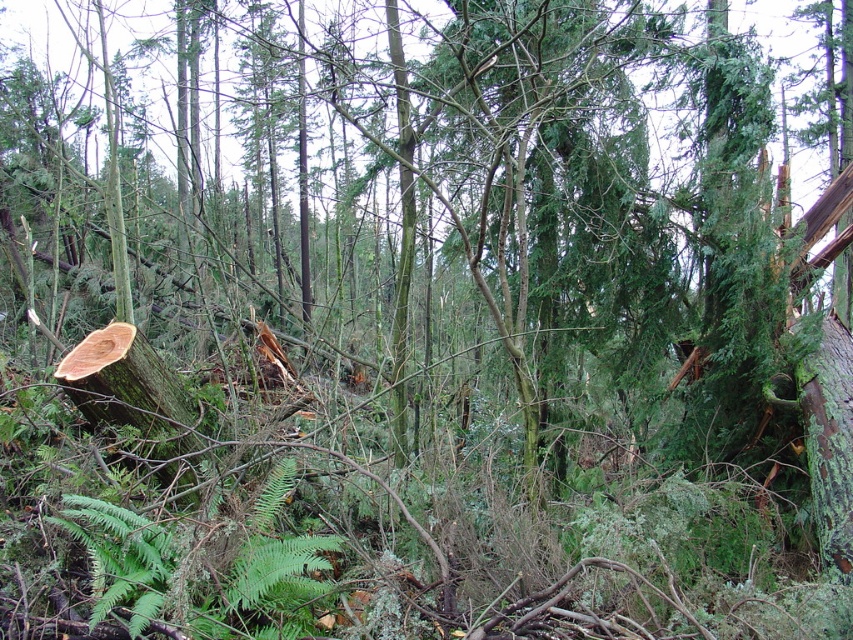
Question: Which of these objects is positioned closest to the green fuzzy fern at center?

Choices:
 (A) green rough tree trunk at lower left
 (B) green rough bark tree trunk at right

Answer: (A)

Question: Estimate the real-world distances between objects in this image. Which object is closer to the green rough bark tree trunk at right?

Choices:
 (A) green fuzzy fern at center
 (B) green rough tree trunk at lower left

Answer: (A)

Question: Which point appears farthest from the camera in this image?

Choices:
 (A) (833, 550)
 (B) (173, 387)

Answer: (B)

Question: From the image, what is the correct spatial relationship of green fuzzy fern at center in relation to green rough bark tree trunk at right?

Choices:
 (A) right
 (B) left

Answer: (B)

Question: Does green rough tree trunk at lower left appear on the left side of green rough bark tree trunk at right?

Choices:
 (A) no
 (B) yes

Answer: (B)

Question: Is green fuzzy fern at center thinner than green rough bark tree trunk at right?

Choices:
 (A) yes
 (B) no

Answer: (A)